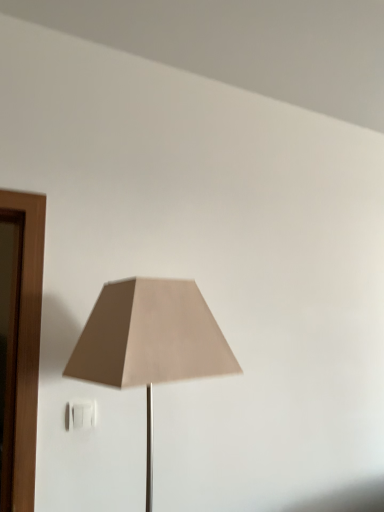
Question: Would you say white plastic electric outlet at lower left is inside or outside beige fabric lampshade at center?

Choices:
 (A) outside
 (B) inside

Answer: (A)

Question: From the image's perspective, is white plastic electric outlet at lower left located above or below beige fabric lampshade at center?

Choices:
 (A) above
 (B) below

Answer: (B)

Question: Based on their positions, is white plastic electric outlet at lower left located to the left or right of beige fabric lampshade at center?

Choices:
 (A) left
 (B) right

Answer: (A)

Question: Is beige fabric lampshade at center situated inside white plastic electric outlet at lower left or outside?

Choices:
 (A) inside
 (B) outside

Answer: (B)

Question: From a real-world perspective, relative to white plastic electric outlet at lower left, is beige fabric lampshade at center vertically above or below?

Choices:
 (A) above
 (B) below

Answer: (A)

Question: From the image's perspective, is beige fabric lampshade at center located above or below white plastic electric outlet at lower left?

Choices:
 (A) above
 (B) below

Answer: (A)

Question: Is beige fabric lampshade at center wider or thinner than white plastic electric outlet at lower left?

Choices:
 (A) thin
 (B) wide

Answer: (B)